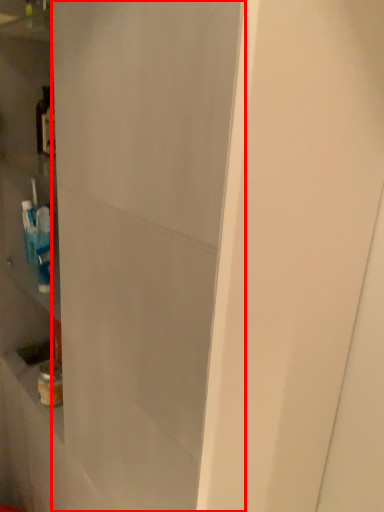
Question: In this image, where is glass door (annotated by the red box) located relative to bottle?

Choices:
 (A) left
 (B) right

Answer: (B)